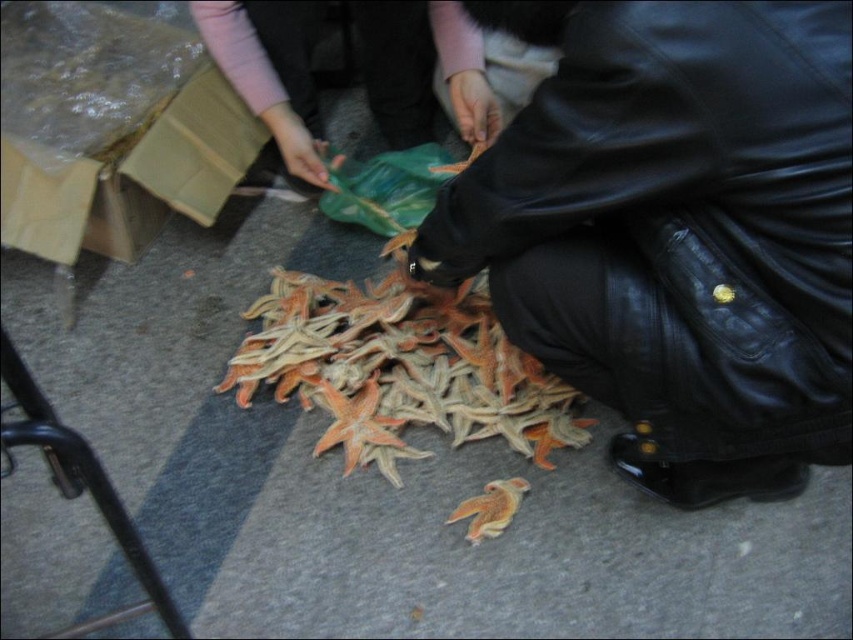
From the picture: You are a customer at a market stall and you see a leather jacket at lower right and an orange matte starfish at center. Which item is bigger in size?

The leather jacket at lower right is larger in size than the orange matte starfish at center.

You are standing at the entrance of the store and see a leather jacket at lower right. Where is the point at coordinate (675, 232) located?

The point at coordinate (675, 232) is located on the leather jacket at lower right.

Based on the photo, you are a delivery person who needs to place a fragile package in the space between the leather jacket at lower right and the orange matte starfish at center. The package requires at least 3 inches of space to avoid damage. Can you fit it there?

The leather jacket at lower right is thinner than the orange matte starfish at center. However, the exact dimensions of the space between them are not provided, so it is uncertain whether the 3 inches requirement can be met. Further measurement is needed.